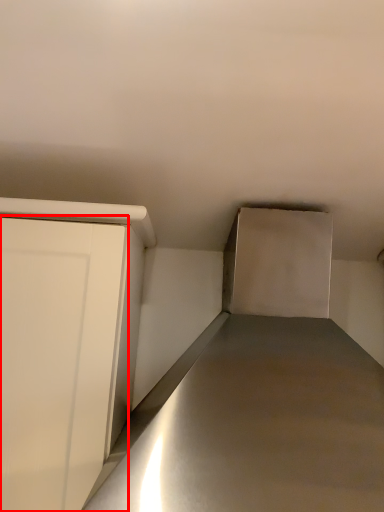
Question: From the image's perspective, considering the relative positions of door (annotated by the red box) and counter top in the image provided, where is door (annotated by the red box) located with respect to the staircase?

Choices:
 (A) above
 (B) below

Answer: (B)